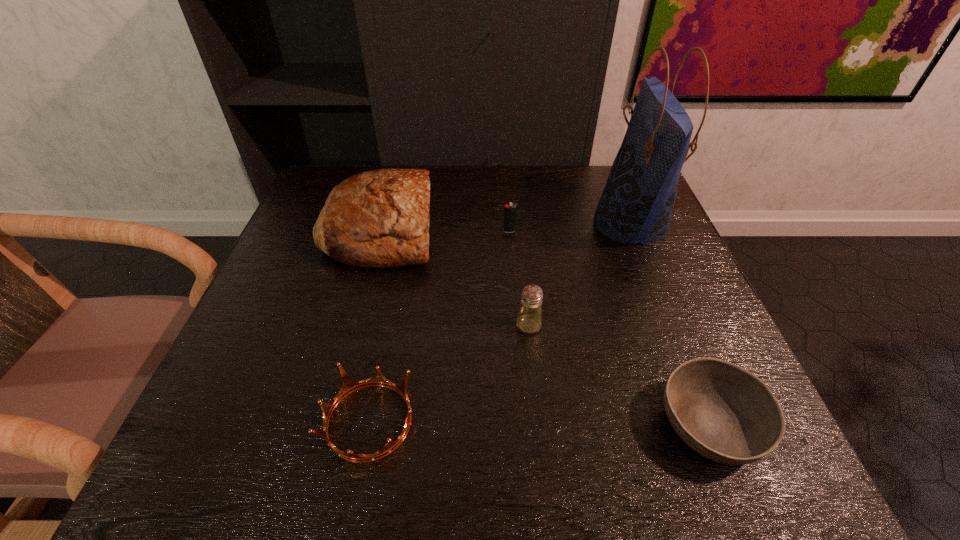
Where is `free spot between the bowl and the shopping bag`? This screenshot has height=540, width=960. free spot between the bowl and the shopping bag is located at coordinates (670, 325).

The width and height of the screenshot is (960, 540). In order to click on empty location between the shopping bag and the third tallest object in this screenshot , I will do `click(580, 275)`.

Identify the location of free space between the igniter and the bowl. (610, 328).

I want to click on vacant space that is in between the shopping bag and the crown, so click(500, 322).

Find the location of a particular element. This screenshot has height=540, width=960. free space between the igniter and the crown is located at coordinates (440, 326).

In order to click on vacant area that lies between the second tallest object and the crown in this screenshot , I will do `click(374, 326)`.

Find the location of a particular element. free space that is in between the saltshaker and the bowl is located at coordinates (619, 375).

Image resolution: width=960 pixels, height=540 pixels. Identify the location of object that is the second closest to the tallest object. (529, 320).

Point out which object is positioned as the nearest to the bread. Please provide its 2D coordinates. Your answer should be formatted as a tuple, i.e. [(x, y)], where the tuple contains the x and y coordinates of a point satisfying the conditions above.

[(510, 211)]

This screenshot has width=960, height=540. I want to click on vacant space that satisfies the following two spatial constraints: 1. at the sliced front of the bowl; 2. on the left side of the second tallest object, so click(x=329, y=426).